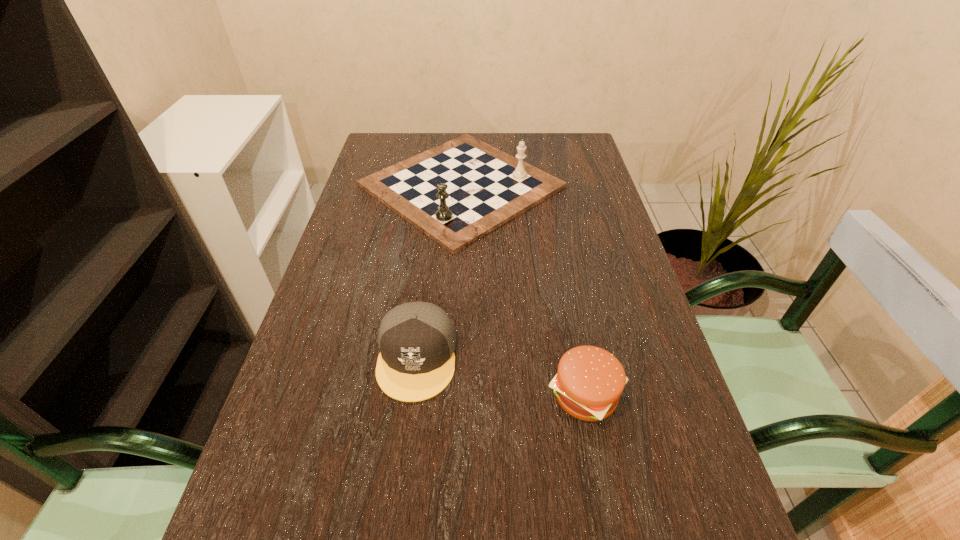
At what (x,y) coordinates should I click in order to perform the action: click on gameboard. Please return your answer as a coordinate pair (x, y). Looking at the image, I should click on (457, 192).

This screenshot has width=960, height=540. Find the location of `the farthest object`. the farthest object is located at coordinates (457, 192).

Locate an element on the screen. The height and width of the screenshot is (540, 960). cap is located at coordinates (417, 340).

Where is `hamburger`? The image size is (960, 540). hamburger is located at coordinates (589, 382).

What are the coordinates of `free space located on the front of the gameboard` in the screenshot? It's located at (455, 295).

Identify the location of free point located on the front-facing side of the cap. (400, 489).

Locate an element on the screen. This screenshot has width=960, height=540. blank space located on the left of the hamburger is located at coordinates click(394, 395).

Where is `object present at the far edge`? This screenshot has width=960, height=540. object present at the far edge is located at coordinates (457, 192).

At what (x,y) coordinates should I click in order to perform the action: click on object that is at the left edge. Please return your answer as a coordinate pair (x, y). The width and height of the screenshot is (960, 540). Looking at the image, I should click on (457, 192).

This screenshot has height=540, width=960. In order to click on gameboard that is at the right edge in this screenshot , I will do `click(457, 192)`.